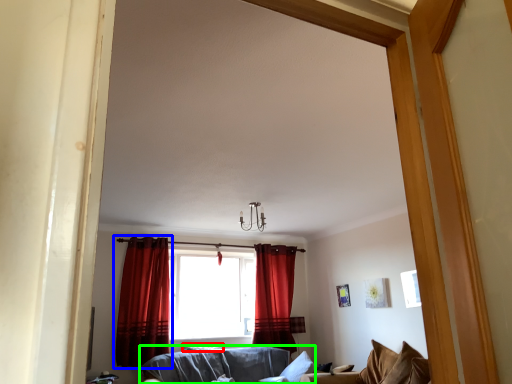
Question: Which object is the farthest from pillow (highlighted by a red box)? Choose among these: curtain (highlighted by a blue box) or studio couch (highlighted by a green box).

Choices:
 (A) curtain
 (B) studio couch

Answer: (A)